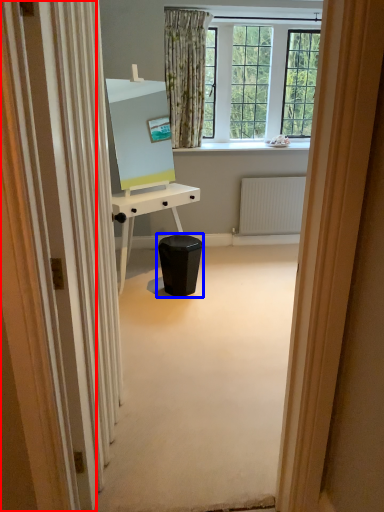
Question: Among these objects, which one is nearest to the camera, screen door (highlighted by a red box) or music stool (highlighted by a blue box)?

Choices:
 (A) screen door
 (B) music stool

Answer: (A)